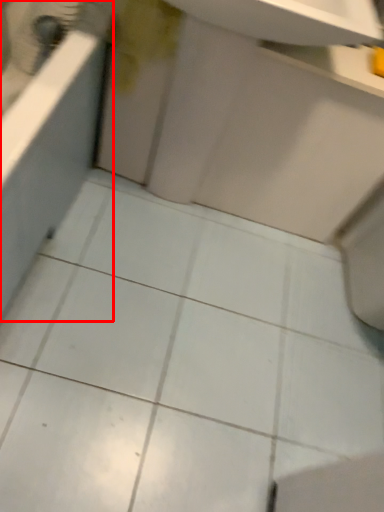
Question: From the image's perspective, considering the relative positions of bath (annotated by the red box) and sink in the image provided, where is bath (annotated by the red box) located with respect to the staircase?

Choices:
 (A) below
 (B) above

Answer: (A)